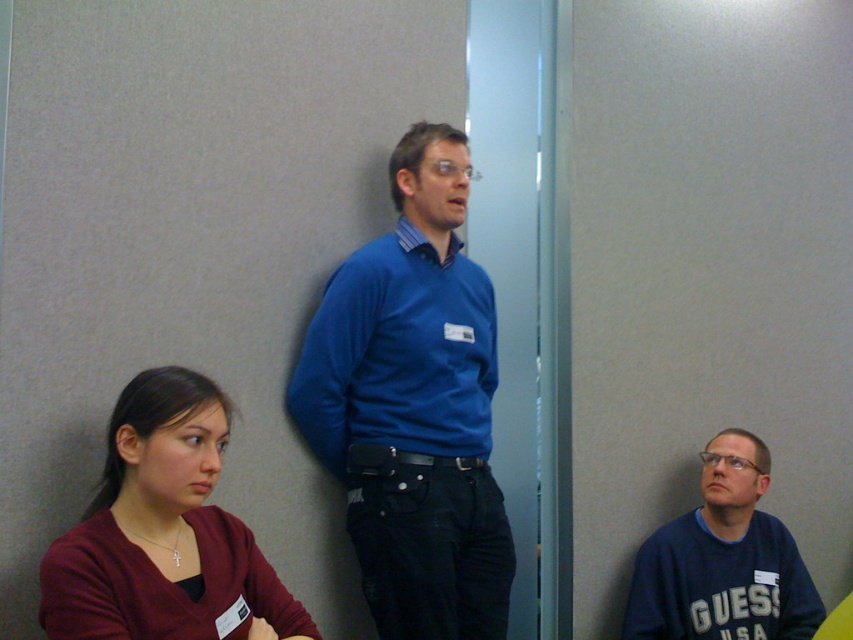
Is blue cotton sweatshirt at lower right to the left of blue smooth shirt at center from the viewer's perspective?

In fact, blue cotton sweatshirt at lower right is to the right of blue smooth shirt at center.

Is point (759, 481) positioned in front of point (428, 260)?

No, it is not.

This screenshot has height=640, width=853. I want to click on blue cotton sweatshirt at lower right, so click(x=723, y=561).

Find the location of `blue cotton sweatshirt at lower right`. blue cotton sweatshirt at lower right is located at coordinates (723, 561).

Between blue matte sweater at center and maroon sweater at lower left, which one appears on the left side from the viewer's perspective?

From the viewer's perspective, maroon sweater at lower left appears more on the left side.

In the scene shown: Is blue matte sweater at center above maroon sweater at lower left?

Yes.

Who is more distant from viewer, (393, 444) or (134, 547)?

The point (393, 444) is behind.

You are a GUI agent. You are given a task and a screenshot of the screen. Output one action in this format:
    pyautogui.click(x=<x>, y=<y>)
    Task: Click on the blue matte sweater at center
    
    Given the screenshot: What is the action you would take?
    pyautogui.click(x=410, y=436)

Does blue matte sweater at center have a lesser height compared to blue cotton sweatshirt at lower right?

No.

Consider the image. Can you confirm if blue matte sweater at center is bigger than blue cotton sweatshirt at lower right?

Correct, blue matte sweater at center is larger in size than blue cotton sweatshirt at lower right.

The image size is (853, 640). Find the location of `blue matte sweater at center`. blue matte sweater at center is located at coordinates (410, 436).